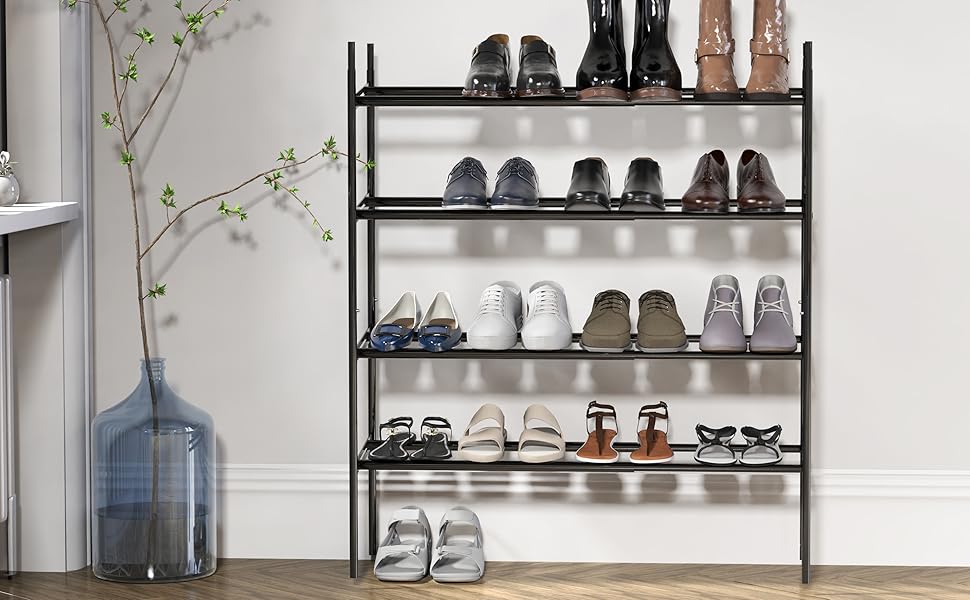
The height and width of the screenshot is (600, 970). Identify the location of sandals on bottom shelf. (396, 445), (431, 439), (475, 438), (526, 436), (588, 447), (654, 451), (710, 445), (751, 451).